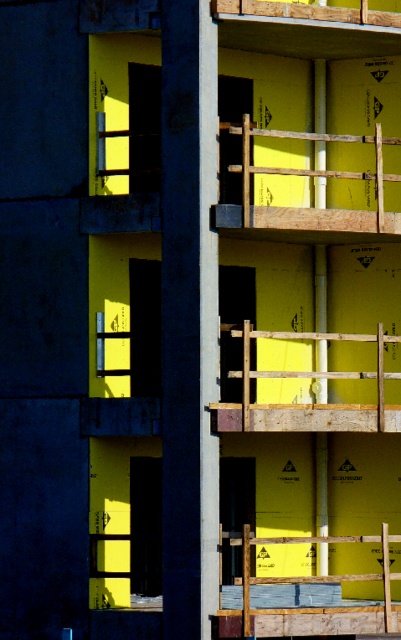
Question: Is wooden frame at center to the left of yellow foam insulation at center from the viewer's perspective?

Choices:
 (A) no
 (B) yes

Answer: (A)

Question: Is yellow foam insulation at center positioned at the back of wooden at upper center?

Choices:
 (A) no
 (B) yes

Answer: (A)

Question: Does wooden frame at center come behind wooden at upper center?

Choices:
 (A) yes
 (B) no

Answer: (B)

Question: Based on their relative distances, which object is farther from the yellow foam insulation at center?

Choices:
 (A) wooden frame at center
 (B) wooden at upper center

Answer: (B)

Question: Which object is the farthest from the wooden at upper center?

Choices:
 (A) wooden frame at center
 (B) yellow foam insulation at center

Answer: (B)

Question: Among these points, which one is nearest to the camera?

Choices:
 (A) (376, 404)
 (B) (330, 227)
 (C) (313, 632)

Answer: (C)